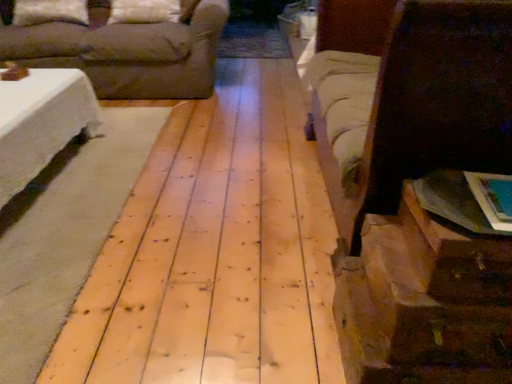
Question: Should I look upward or downward to see brown paper bag at lower right?

Choices:
 (A) down
 (B) up

Answer: (A)

Question: Can you confirm if brown fabric couch at upper left is smaller than brown paper bag at lower right?

Choices:
 (A) yes
 (B) no

Answer: (B)

Question: Is brown fabric couch at upper left positioned with its back to brown paper bag at lower right?

Choices:
 (A) no
 (B) yes

Answer: (A)

Question: Does brown fabric couch at upper left appear on the right side of brown paper bag at lower right?

Choices:
 (A) no
 (B) yes

Answer: (A)

Question: Can you confirm if brown fabric couch at upper left is wider than brown paper bag at lower right?

Choices:
 (A) no
 (B) yes

Answer: (B)

Question: Does brown fabric couch at upper left appear on the left side of brown paper bag at lower right?

Choices:
 (A) no
 (B) yes

Answer: (B)

Question: From the image's perspective, is brown fabric couch at upper left under brown paper bag at lower right?

Choices:
 (A) yes
 (B) no

Answer: (B)

Question: Is brown paper bag at lower right at the right side of white soft pillow at upper left, which is the 1th pillow from left to right?

Choices:
 (A) no
 (B) yes

Answer: (B)

Question: Is brown paper bag at lower right shorter than white soft pillow at upper left, which is the 1th pillow from left to right?

Choices:
 (A) yes
 (B) no

Answer: (A)

Question: Does brown paper bag at lower right touch white soft pillow at upper left, which is the 1th pillow from left to right?

Choices:
 (A) no
 (B) yes

Answer: (A)

Question: Does brown paper bag at lower right have a greater height compared to white soft pillow at upper left, which is the 1th pillow from left to right?

Choices:
 (A) yes
 (B) no

Answer: (B)

Question: Are brown paper bag at lower right and white soft pillow at upper left, which is the 1th pillow from left to right, far apart?

Choices:
 (A) yes
 (B) no

Answer: (A)

Question: Is brown paper bag at lower right to the left of white soft pillow at upper left, which is the 1th pillow from left to right, from the viewer's perspective?

Choices:
 (A) yes
 (B) no

Answer: (B)

Question: Does white fabric pillow at upper center, the 2th pillow positioned from the left, lie in front of brown fabric bed at right?

Choices:
 (A) yes
 (B) no

Answer: (B)